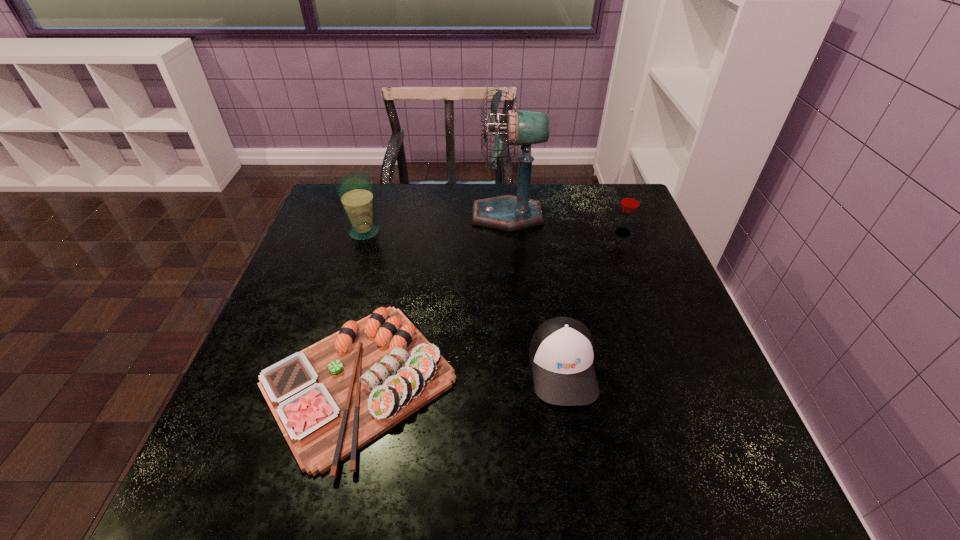
Identify which object is the third nearest to the right glass. Please provide its 2D coordinates. Your answer should be formatted as a tuple, i.e. [(x, y)], where the tuple contains the x and y coordinates of a point satisfying the conditions above.

[(331, 399)]

Find the location of a particular element. vacant area that satisfies the following two spatial constraints: 1. on the front side of the taller glass; 2. on the left side of the shortest object is located at coordinates (318, 382).

I want to click on vacant position in the image that satisfies the following two spatial constraints: 1. in front of the third tallest object where the wind blows; 2. on the right side of the fan, so click(509, 233).

The height and width of the screenshot is (540, 960). What are the coordinates of `free spot that satisfies the following two spatial constraints: 1. on the front side of the right glass; 2. on the right side of the fourth shortest object` in the screenshot? It's located at (364, 233).